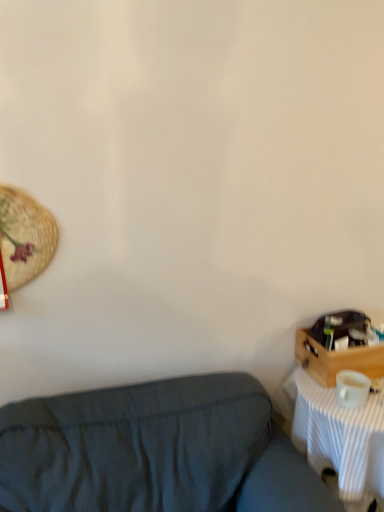
At what (x,y) coordinates should I click in order to perform the action: click on free space to the left of white matte coffee cup at right. Please return your answer as a coordinate pair (x, y). The height and width of the screenshot is (512, 384). Looking at the image, I should click on click(317, 397).